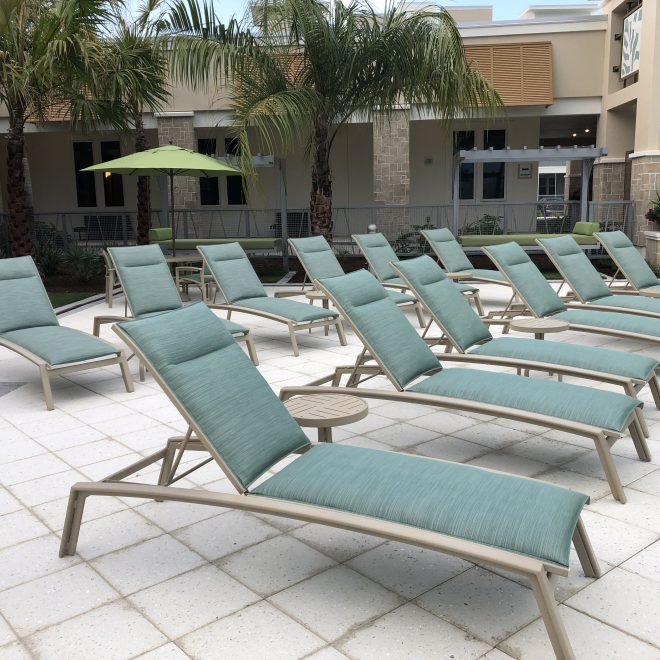
This screenshot has width=660, height=660. What are the coordinates of `tables` in the screenshot? It's located at (338, 410), (530, 319), (319, 294), (466, 271).